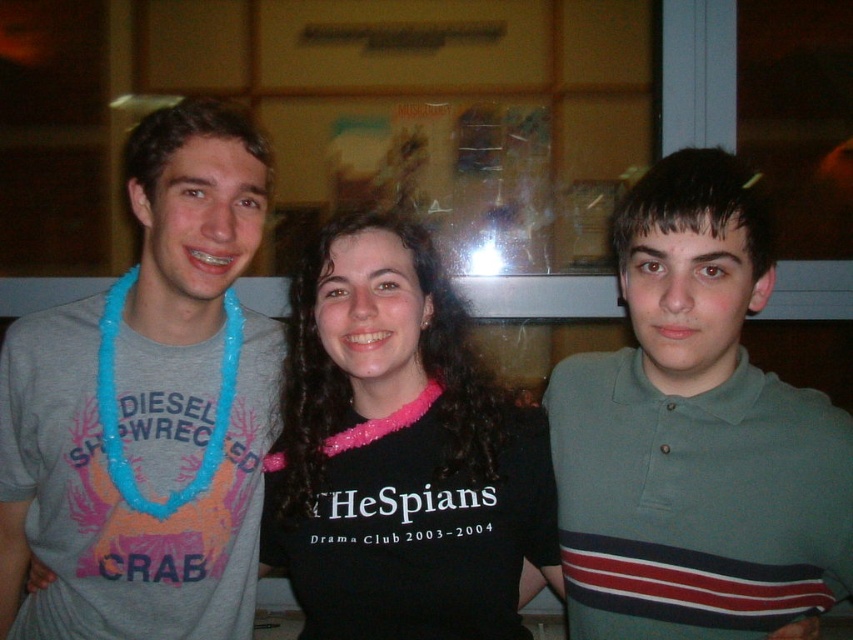
You are standing at the point marked as point (503, 636). You need to reach the door located 3.76 feet away from you. Can you walk straight to the door without moving sideways?

Yes, you can walk straight to the door because the distance between you and the door is exactly 3.76 feet, which means moving straight ahead will reach it without needing to move sideways.

You are standing in the room where the three people are posing. You want to take a photo of the point at coordinates point (126, 176). Is this point within your camera view? Assume your camera has a standard field of view and you are positioned at the same level as the people.

The point (126, 176) is 4.17 feet away from the camera. Assuming a standard field of view, this distance is within typical camera range, so yes, the point is within the camera view.

You are a photographer adjusting your camera settings to focus on the black fabric shirt at center and the blue beaded necklace at left. Which object should you focus on first to ensure proper depth of field?

The black fabric shirt at center is closer to the viewer than the blue beaded necklace at left, so you should focus on the black fabric shirt at center first to ensure proper depth of field.